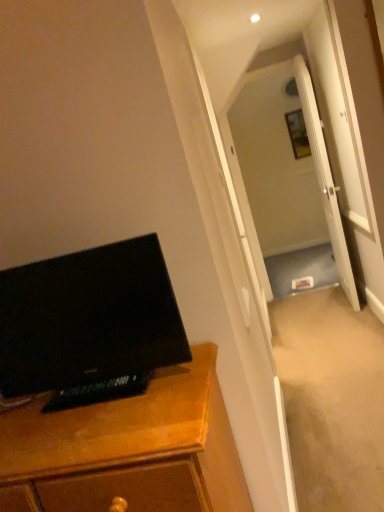
Locate an element on the screen. This screenshot has width=384, height=512. transparent glass door at center is located at coordinates (312, 159).

What do you see at coordinates (89, 322) in the screenshot?
I see `black glossy monitor at left` at bounding box center [89, 322].

The width and height of the screenshot is (384, 512). What do you see at coordinates (132, 447) in the screenshot?
I see `wooden cabinet at left` at bounding box center [132, 447].

What are the coordinates of `white glossy door at center` in the screenshot? It's located at (325, 180).

Considering the points (327, 190) and (33, 342), which point is behind, point (327, 190) or point (33, 342)?

The point (327, 190) is farther from the camera.

Is white glossy door at center not inside black glossy monitor at left?

Yes, white glossy door at center is outside of black glossy monitor at left.

How different are the orientations of white glossy door at center and black glossy monitor at left in degrees?

94.6 degrees.

Is white glossy door at center looking in the opposite direction of black glossy monitor at left?

No, white glossy door at center's orientation is not away from black glossy monitor at left.

Could you tell me if transparent glass door at center is facing wooden cabinet at left?

No, transparent glass door at center is not oriented towards wooden cabinet at left.

Is transparent glass door at center spatially inside wooden cabinet at left, or outside of it?

transparent glass door at center is not enclosed by wooden cabinet at left.

Locate an element on the screen. glass door that is above the wooden cabinet at left (from a real-world perspective) is located at coordinates (312, 159).

Which object is thinner, black glossy monitor at left or white glossy door at center?

Thinner between the two is black glossy monitor at left.

Where is `computer monitor that is in front of the white glossy door at center`? This screenshot has width=384, height=512. computer monitor that is in front of the white glossy door at center is located at coordinates (89, 322).

Is white glossy door at center turned away from transparent glass door at center?

That's not correct — white glossy door at center is not looking away from transparent glass door at center.

Is white glossy door at center not within transparent glass door at center?

Yes, white glossy door at center is not within transparent glass door at center.

Is point (328, 165) behind point (224, 143)?

Yes, it is behind point (224, 143).

Could you tell me if transparent glass door at center is turned towards wooden picture frame at upper center?

No, transparent glass door at center is not facing towards wooden picture frame at upper center.

This screenshot has height=512, width=384. I want to click on picture frame on the right of transparent glass door at center, so click(298, 134).

From the image's perspective, which is below, transparent glass door at center or wooden picture frame at upper center?

transparent glass door at center is shown below in the image.

How many degrees apart are the facing directions of transparent glass door at center and wooden picture frame at upper center?

The angular difference between transparent glass door at center and wooden picture frame at upper center is 0.635 degrees.

From the picture: From a real-world perspective, which object rests below the other?

transparent glass door at center, from a real-world perspective.

Does transparent glass door at center appear on the right side of black glossy monitor at left?

Yes, transparent glass door at center is to the right of black glossy monitor at left.

Looking at this image, is there a large distance between transparent glass door at center and black glossy monitor at left?

transparent glass door at center is positioned a significant distance from black glossy monitor at left.

From the picture: Is transparent glass door at center aimed at black glossy monitor at left?

No.

Is black glossy monitor at left looking in the opposite direction of wooden cabinet at left?

No, black glossy monitor at left's orientation is not away from wooden cabinet at left.

Between black glossy monitor at left and wooden cabinet at left, which one has smaller width?

black glossy monitor at left is thinner.

Considering the positions of points (144, 308) and (176, 461), is point (144, 308) closer to camera compared to point (176, 461)?

No, it is behind (176, 461).

The height and width of the screenshot is (512, 384). I want to click on computer monitor in front of the white glossy door at center, so click(x=89, y=322).

Image resolution: width=384 pixels, height=512 pixels. I want to click on cabinetry located on the left of transparent glass door at center, so click(132, 447).

Considering their positions, is black glossy monitor at left positioned closer to wooden picture frame at upper center than wooden cabinet at left?

Among the two, black glossy monitor at left is located nearer to wooden picture frame at upper center.

Based on the photo, considering their positions, is black glossy monitor at left positioned closer to white glossy door at center than wooden cabinet at left?

black glossy monitor at left is positioned closer to the anchor white glossy door at center.

Which object lies nearer to the anchor point wooden picture frame at upper center, wooden cabinet at left or white glossy door at center?

The object closer to wooden picture frame at upper center is white glossy door at center.

Considering their positions, is wooden picture frame at upper center positioned closer to wooden cabinet at left than black glossy monitor at left?

Among the two, black glossy monitor at left is located nearer to wooden cabinet at left.

Looking at the image, which one is located closer to white glossy door at center, wooden picture frame at upper center or transparent glass door at center?

Based on the image, transparent glass door at center appears to be nearer to white glossy door at center.

From the picture: Estimate the real-world distances between objects in this image. Which object is closer to black glossy monitor at left, white glossy door at center or transparent glass door at center?

Among the two, transparent glass door at center is located nearer to black glossy monitor at left.

Which object lies further to the anchor point black glossy monitor at left, wooden cabinet at left or transparent glass door at center?

Based on the image, transparent glass door at center appears to be further to black glossy monitor at left.

Considering their positions, is white glossy door at center positioned further to wooden picture frame at upper center than black glossy monitor at left?

black glossy monitor at left.

Where is `door between black glossy monitor at left and wooden picture frame at upper center in the front-back direction`? door between black glossy monitor at left and wooden picture frame at upper center in the front-back direction is located at coordinates (325, 180).

This screenshot has width=384, height=512. I want to click on computer monitor positioned between wooden cabinet at left and transparent glass door at center from near to far, so click(x=89, y=322).

Locate an element on the screen. This screenshot has height=512, width=384. door located between wooden cabinet at left and transparent glass door at center in the depth direction is located at coordinates (325, 180).

Image resolution: width=384 pixels, height=512 pixels. Find the location of `glass door between white glossy door at center and wooden picture frame at upper center along the z-axis`. glass door between white glossy door at center and wooden picture frame at upper center along the z-axis is located at coordinates (312, 159).